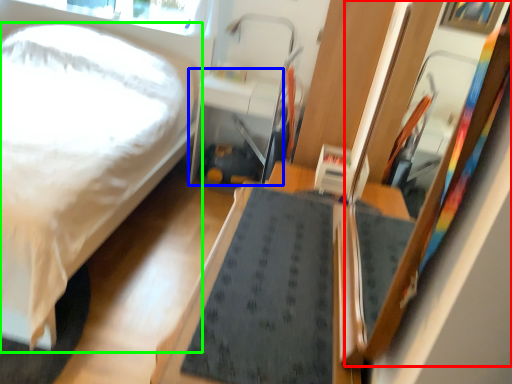
Question: Which is nearer to the mirror (highlighted by a red box)? table (highlighted by a blue box) or bed (highlighted by a green box).

Choices:
 (A) table
 (B) bed

Answer: (B)